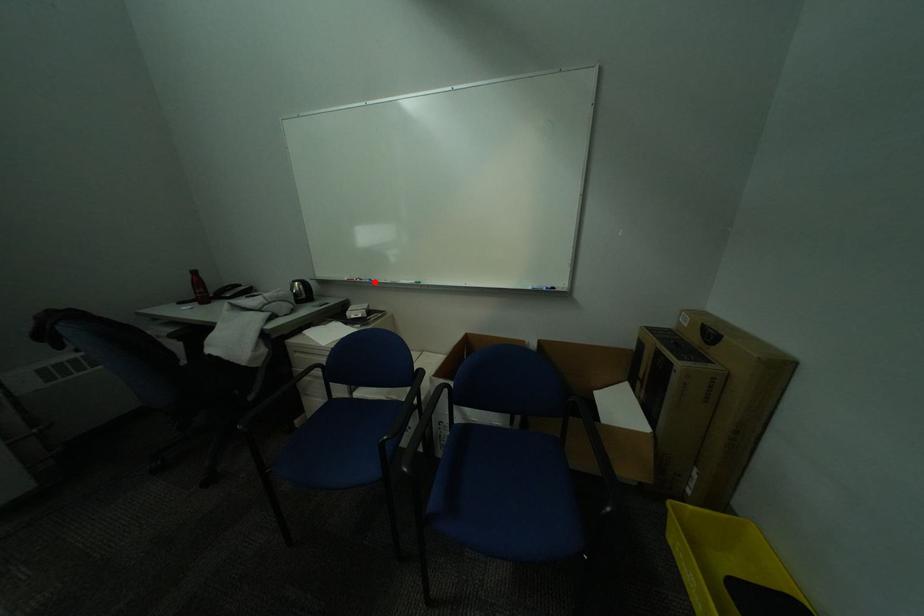
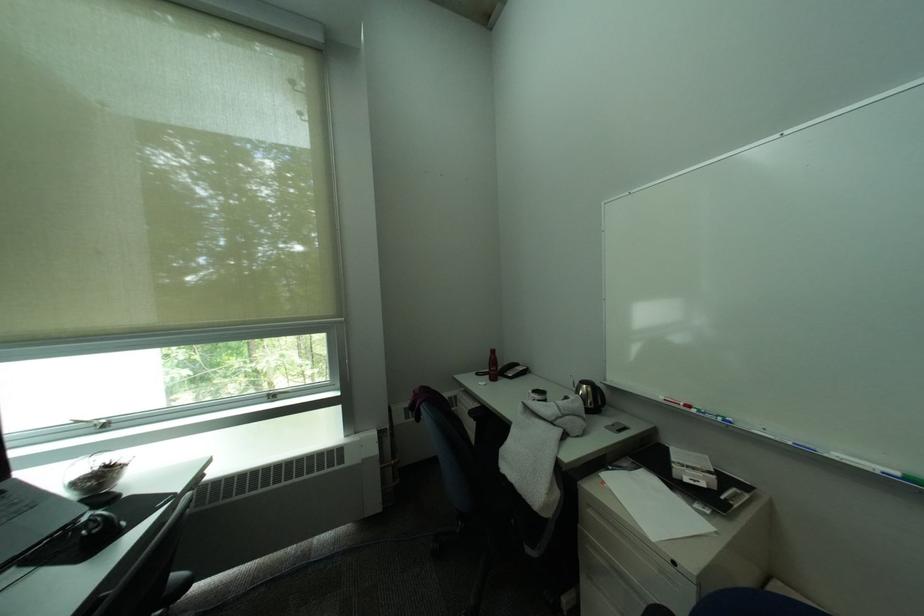
Locate, in the second image, the point that corresponds to the highlighted location in the first image.

(719, 416)